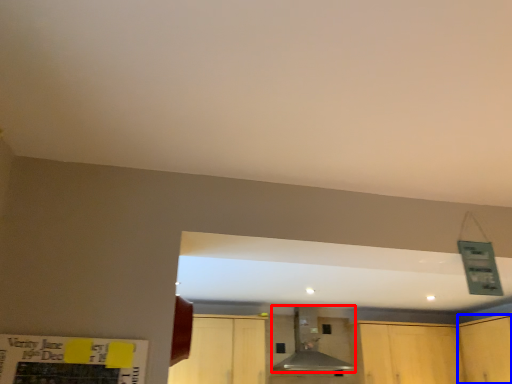
Question: Which object appears farthest to the camera in this image, vent (highlighted by a red box) or cabinetry (highlighted by a blue box)?

Choices:
 (A) vent
 (B) cabinetry

Answer: (A)